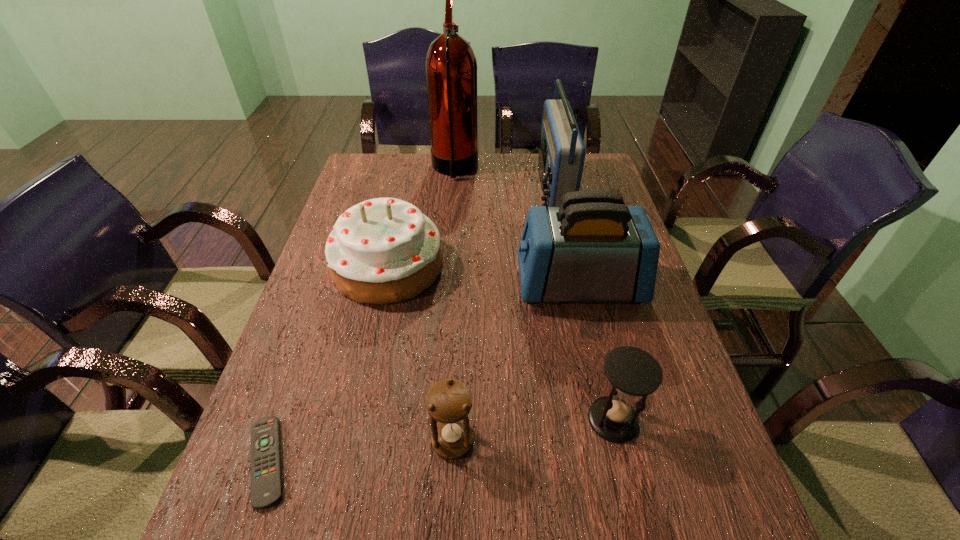
Where is `object that ranks as the second closest to the toaster`? object that ranks as the second closest to the toaster is located at coordinates (383, 250).

At what (x,y) coordinates should I click in order to perform the action: click on free space that satisfies the following two spatial constraints: 1. on the front-facing side of the fire extinguisher; 2. on the front side of the remote control. Please return your answer as a coordinate pair (x, y). This screenshot has height=540, width=960. Looking at the image, I should click on (x=432, y=461).

This screenshot has width=960, height=540. What are the coordinates of `vacant area in the image that satisfies the following two spatial constraints: 1. on the front panel of the right hourglass; 2. on the left side of the radio receiver` in the screenshot? It's located at (600, 420).

Identify the location of blank area in the image that satisfies the following two spatial constraints: 1. on the front-facing side of the right hourglass; 2. on the right side of the toaster. The image size is (960, 540). (610, 420).

This screenshot has height=540, width=960. What are the coordinates of `blank area in the image that satisfies the following two spatial constraints: 1. on the front panel of the right hourglass; 2. on the right side of the radio receiver` in the screenshot? It's located at click(600, 420).

Find the location of a particular element. The width and height of the screenshot is (960, 540). vacant region that satisfies the following two spatial constraints: 1. on the front panel of the right hourglass; 2. on the left side of the radio receiver is located at coordinates click(x=600, y=420).

Locate an element on the screen. blank space that satisfies the following two spatial constraints: 1. on the front-facing side of the fire extinguisher; 2. on the left side of the right hourglass is located at coordinates (435, 420).